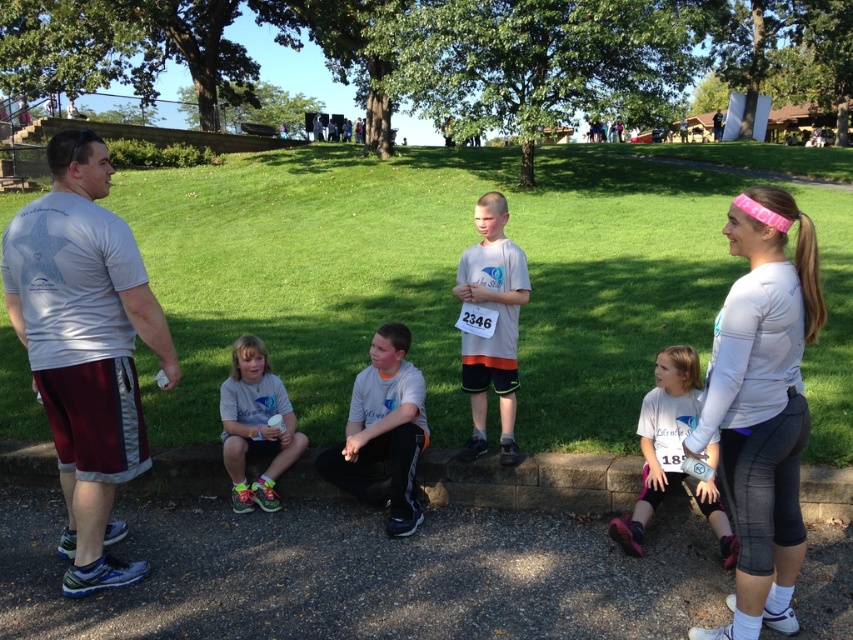
Question: Can you confirm if white matte long-sleeve shirt at right is smaller than matte gray shirt at upper center?

Choices:
 (A) yes
 (B) no

Answer: (A)

Question: Estimate the real-world distances between objects in this image. Which object is closer to the white matte t-shirt at left?

Choices:
 (A) white cotton shirt at upper center
 (B) white matte long-sleeve shirt at right

Answer: (B)

Question: Does white matte shirt at center appear over white matte shirt at lower center?

Choices:
 (A) yes
 (B) no

Answer: (A)

Question: Which point is closer to the camera?

Choices:
 (A) (589, 120)
 (B) (223, 422)
 (C) (337, 134)
 (D) (386, 532)

Answer: (D)

Question: Can you confirm if white matte shirt at center is positioned below matte gray shirt at center?

Choices:
 (A) no
 (B) yes

Answer: (A)

Question: Which point is farther from the camera taking this photo?

Choices:
 (A) (397, 390)
 (B) (251, 452)
 (C) (683, 426)
 (D) (22, 288)

Answer: (B)